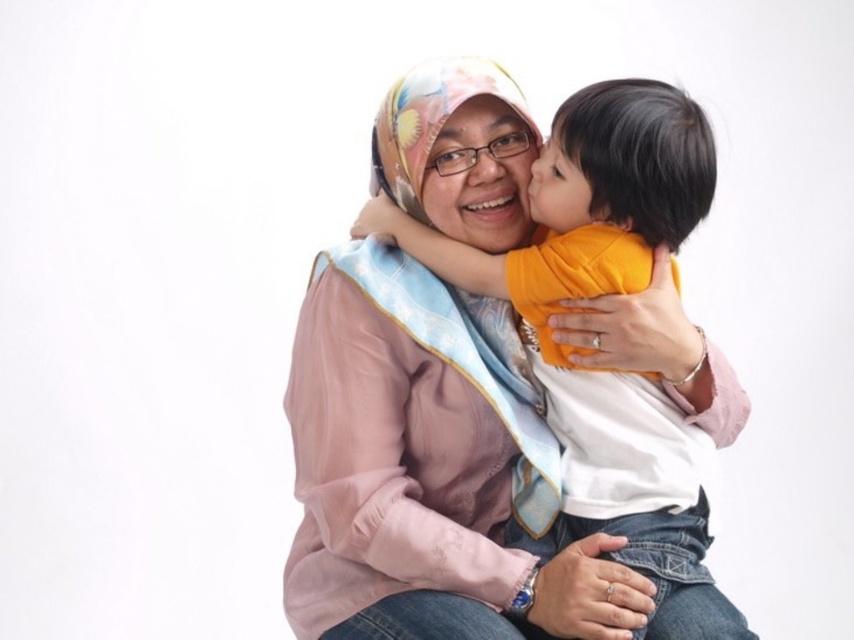
At what (x,y) coordinates should I click in order to perform the action: click on matte pink scarf at center. Please return your answer as a coordinate pair (x, y). The width and height of the screenshot is (854, 640). Looking at the image, I should click on (480, 176).

Between matte pink scarf at center and matte yellow shirt at upper center, which one appears on the left side from the viewer's perspective?

matte pink scarf at center is more to the left.

Identify the location of matte pink scarf at center. The height and width of the screenshot is (640, 854). (480, 176).

This screenshot has height=640, width=854. What are the coordinates of `matte pink scarf at center` in the screenshot? It's located at (480, 176).

Is matte yellow shirt at center thinner than matte yellow shirt at upper center?

In fact, matte yellow shirt at center might be wider than matte yellow shirt at upper center.

Who is more distant from viewer, (x=595, y=260) or (x=575, y=170)?

The point (x=575, y=170) is behind.

Find the location of a particular element. Image resolution: width=854 pixels, height=640 pixels. matte yellow shirt at center is located at coordinates (581, 349).

Is matte yellow shirt at center wider than matte pink scarf at center?

Correct, the width of matte yellow shirt at center exceeds that of matte pink scarf at center.

Is the position of matte yellow shirt at center less distant than that of matte pink scarf at center?

That is True.

What do you see at coordinates (581, 349) in the screenshot? This screenshot has height=640, width=854. I see `matte yellow shirt at center` at bounding box center [581, 349].

You are a GUI agent. You are given a task and a screenshot of the screen. Output one action in this format:
    pyautogui.click(x=<x>, y=<y>)
    Task: Click on the matte yellow shirt at center
    This screenshot has height=640, width=854.
    Given the screenshot: What is the action you would take?
    pyautogui.click(x=581, y=349)